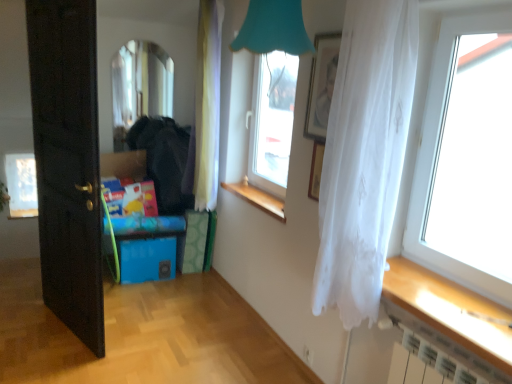
Question: From the image's perspective, does white sheer curtain at right, which is the 2th curtain from back to front, appear lower than transparent glass window at center, arranged as the second window when viewed from the front?

Choices:
 (A) yes
 (B) no

Answer: (A)

Question: From a real-world perspective, does white sheer curtain at right, which appears as the first curtain when viewed from the front, stand above transparent glass window at center, acting as the second window starting from the right?

Choices:
 (A) yes
 (B) no

Answer: (B)

Question: Is transparent glass window at center, arranged as the second window when viewed from the front, a part of white sheer curtain at right, which is the 2th curtain from back to front?

Choices:
 (A) yes
 (B) no

Answer: (B)

Question: From the image's perspective, is white sheer curtain at right, the first curtain from the right, on transparent glass window at center, which ranks as the 3th window in left-to-right order?

Choices:
 (A) yes
 (B) no

Answer: (B)

Question: Considering the relative sizes of white sheer curtain at right, which is the 2th curtain from back to front, and transparent glass window at center, the third window viewed from the back, in the image provided, is white sheer curtain at right, which is the 2th curtain from back to front, wider than transparent glass window at center, the third window viewed from the back,?

Choices:
 (A) no
 (B) yes

Answer: (B)

Question: Would you say white sheer curtain at right, marked as the 2th curtain in a left-to-right arrangement, is outside transparent glass window at center, which ranks as the 3th window in left-to-right order?

Choices:
 (A) no
 (B) yes

Answer: (B)

Question: From a real-world perspective, is transparent glass window at center, the third window viewed from the back, positioned under transparent glass window at right, which appears as the fourth window when viewed from the back, based on gravity?

Choices:
 (A) no
 (B) yes

Answer: (B)

Question: Would you say transparent glass window at right, which appears as the fourth window when viewed from the back, is part of transparent glass window at center, which ranks as the 3th window in left-to-right order,'s contents?

Choices:
 (A) no
 (B) yes

Answer: (A)

Question: Does transparent glass window at center, the third window viewed from the back, have a smaller size compared to transparent glass window at right, the 4th window positioned from the left?

Choices:
 (A) yes
 (B) no

Answer: (B)

Question: Is transparent glass window at center, the third window viewed from the back, thinner than transparent glass window at right, the 4th window positioned from the left?

Choices:
 (A) no
 (B) yes

Answer: (A)

Question: Is transparent glass window at center, which ranks as the 3th window in left-to-right order, aimed at transparent glass window at right, which appears as the fourth window when viewed from the back?

Choices:
 (A) yes
 (B) no

Answer: (B)

Question: Is the position of transparent glass window at center, which ranks as the 3th window in left-to-right order, more distant than that of transparent glass window at right, acting as the 1th window starting from the front?

Choices:
 (A) no
 (B) yes

Answer: (B)

Question: Is blue plastic storage box at lower left not close to transparent fabric curtain at right?

Choices:
 (A) yes
 (B) no

Answer: (A)